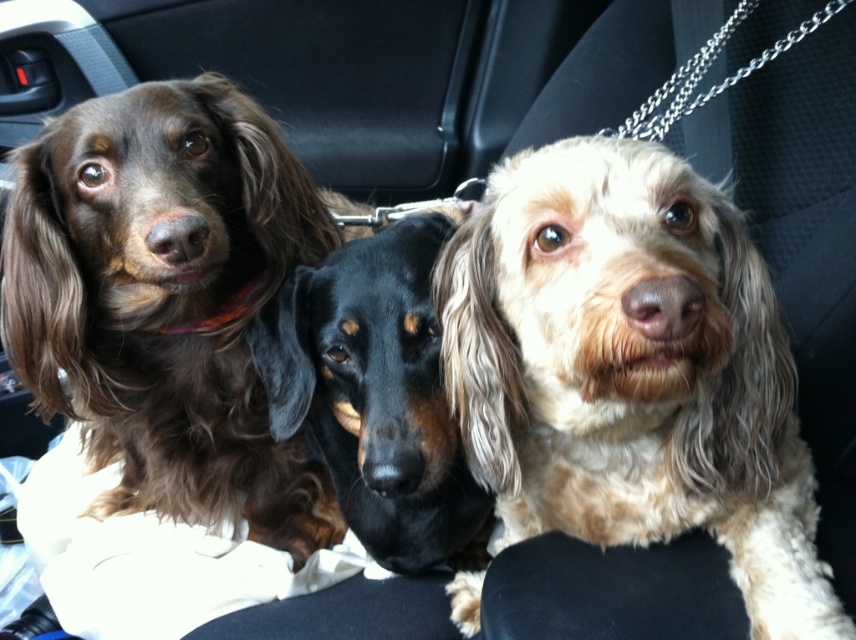
Can you confirm if light brown fur at center is thinner than brown fur dog at left?

Yes, light brown fur at center is thinner than brown fur dog at left.

In the scene shown: Is light brown fur at center wider than brown fur dog at left?

Incorrect, light brown fur at center's width does not surpass brown fur dog at left's.

Does point (548, 211) lie behind point (131, 102)?

No, (548, 211) is closer to viewer.

Where is `light brown fur at center`? light brown fur at center is located at coordinates (632, 371).

Is point (223, 204) positioned behind point (440, 484)?

Yes, it is behind point (440, 484).

Can you confirm if brown fur dog at left is positioned to the left of black shiny coat at center?

Indeed, brown fur dog at left is positioned on the left side of black shiny coat at center.

What do you see at coordinates (165, 300) in the screenshot?
I see `brown fur dog at left` at bounding box center [165, 300].

Where is `brown fur dog at left`? This screenshot has height=640, width=856. brown fur dog at left is located at coordinates (165, 300).

From the picture: Is light brown fur at center above black shiny coat at center?

Actually, light brown fur at center is below black shiny coat at center.

Does light brown fur at center have a lesser height compared to black shiny coat at center?

Incorrect, light brown fur at center's height does not fall short of black shiny coat at center's.

Does point (646, 204) come farther from viewer compared to point (373, 252)?

No, (646, 204) is closer to viewer.

The height and width of the screenshot is (640, 856). In order to click on light brown fur at center in this screenshot , I will do `click(632, 371)`.